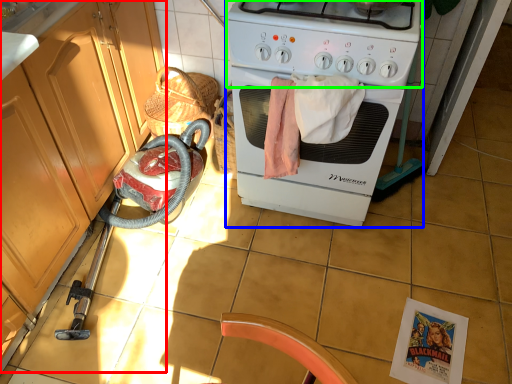
Question: Which object is positioned closest to cabinetry (highlighted by a red box)? Select from home appliance (highlighted by a blue box) and gas stove (highlighted by a green box).

Choices:
 (A) home appliance
 (B) gas stove

Answer: (A)